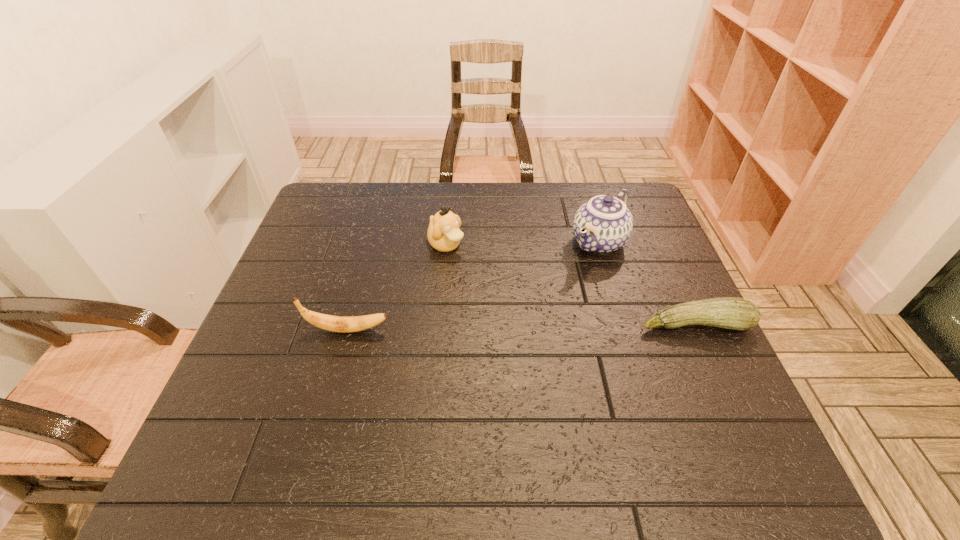
In the image, there is a desktop. At what (x,y) coordinates should I click in order to perform the action: click on free space at the near edge. Please return your answer as a coordinate pair (x, y). This screenshot has width=960, height=540. Looking at the image, I should click on (358, 428).

The height and width of the screenshot is (540, 960). I want to click on vacant space at the left edge, so click(x=268, y=313).

The height and width of the screenshot is (540, 960). Identify the location of blank area at the right edge. (623, 266).

In the image, there is a desktop. Identify the location of free space at the near right corner. (664, 394).

Locate an element on the screen. The height and width of the screenshot is (540, 960). vacant region between the leftmost object and the second object from left to right is located at coordinates (396, 288).

Locate an element on the screen. vacant point located between the third shortest object and the shortest object is located at coordinates (570, 285).

Where is `free space that is in between the chinaware and the third tallest object`? The height and width of the screenshot is (540, 960). free space that is in between the chinaware and the third tallest object is located at coordinates (473, 286).

Locate an element on the screen. Image resolution: width=960 pixels, height=540 pixels. empty location between the third tallest object and the shortest object is located at coordinates (521, 327).

In order to click on vacant area that lies between the chinaware and the banana in this screenshot , I will do `click(473, 286)`.

Identify the location of free area in between the zucchini and the banana. (521, 327).